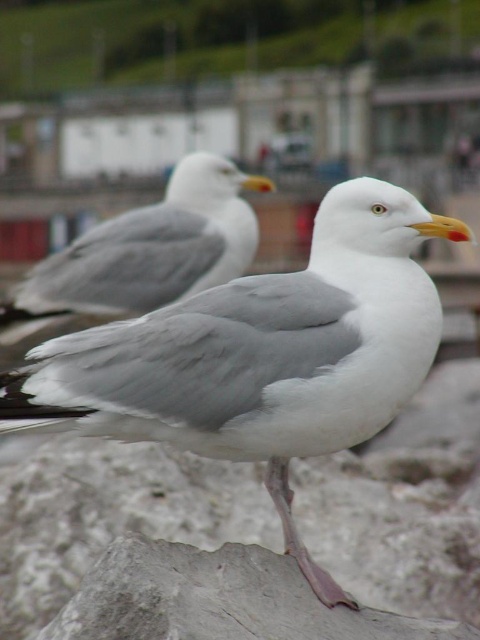
Between white feathered bird at center and white feathered seagull at center, which one is positioned higher?

white feathered seagull at center is above.

Is white feathered bird at center bigger than white feathered seagull at center?

Incorrect, white feathered bird at center is not larger than white feathered seagull at center.

This screenshot has width=480, height=640. I want to click on white feathered bird at center, so (261, 355).

Identify the location of white feathered bird at center. 261,355.